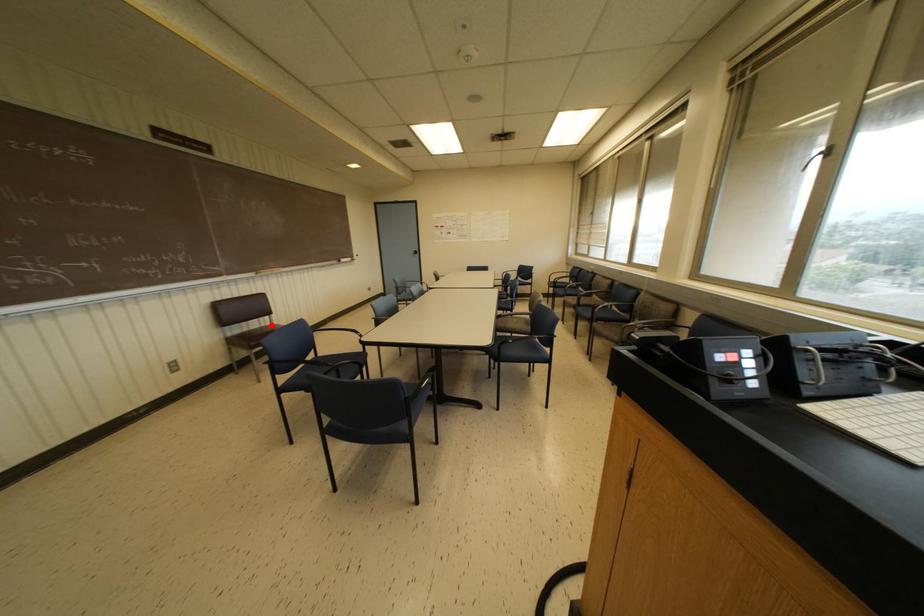
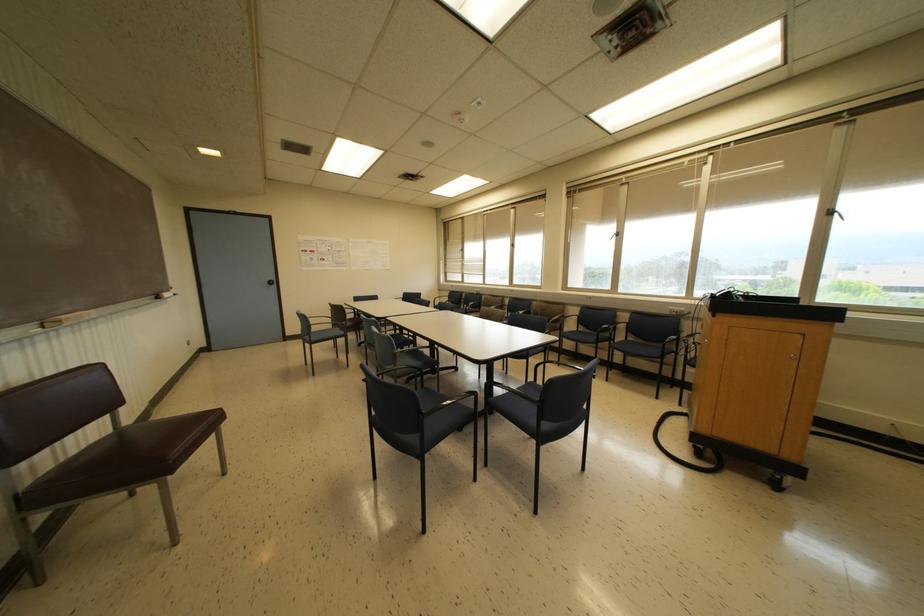
Where in the second image is the point corresponding to the highlighted location from the first image?

(118, 430)